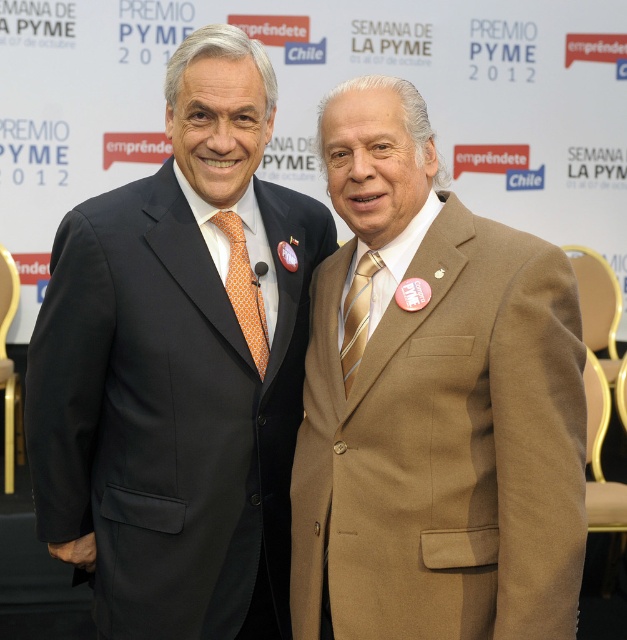
Question: Can you confirm if orange dotted tie at center is positioned below gold metallic tie at center?

Choices:
 (A) no
 (B) yes

Answer: (A)

Question: Is tan wool suit at center thinner than orange dotted tie at center?

Choices:
 (A) yes
 (B) no

Answer: (B)

Question: Which point appears closest to the camera in this image?

Choices:
 (A) (359, 346)
 (B) (424, 506)
 (C) (231, 227)

Answer: (B)

Question: Which point is closer to the camera taking this photo?

Choices:
 (A) (263, 356)
 (B) (409, 179)

Answer: (B)

Question: Is matte black suit at center to the right of orange dotted tie at center from the viewer's perspective?

Choices:
 (A) no
 (B) yes

Answer: (A)

Question: Which point appears farthest from the camera in this image?

Choices:
 (A) (475, 342)
 (B) (233, 202)
 (C) (354, 294)
 (D) (261, 317)

Answer: (D)